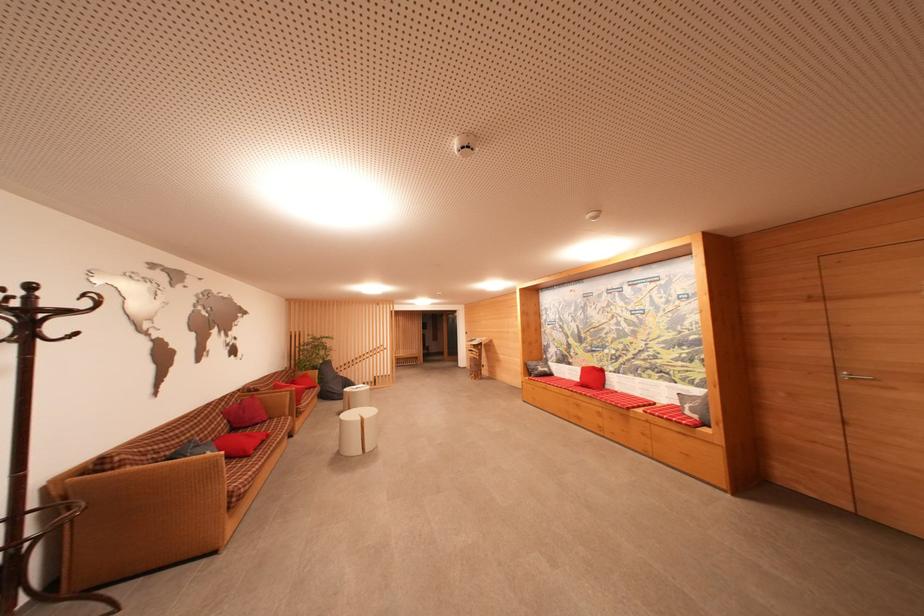
You are a GUI agent. You are given a task and a screenshot of the screen. Output one action in this format:
    pyautogui.click(x=<x>, y=<y>)
    Task: Click on the sofa armrest
    This screenshot has width=924, height=616.
    Given the screenshot: What is the action you would take?
    pyautogui.click(x=191, y=451)